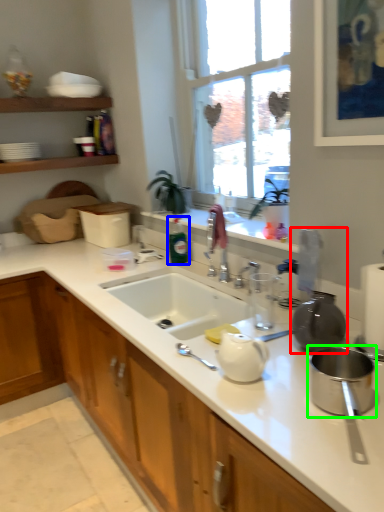
Question: Estimate the real-world distances between objects in this image. Which object is closer to appliance (highlighted by a red box), bottle (highlighted by a blue box) or appliance (highlighted by a green box)?

Choices:
 (A) bottle
 (B) appliance

Answer: (B)